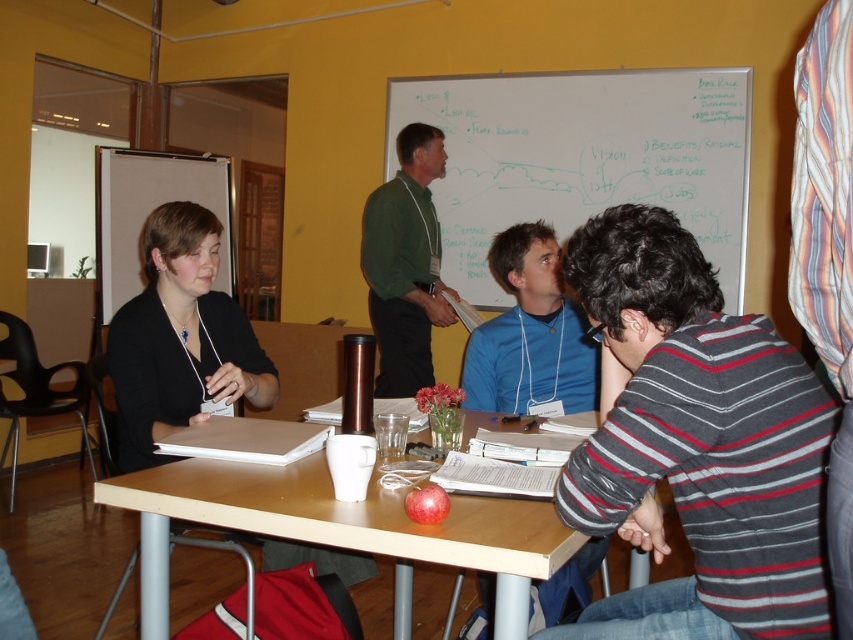
You are standing at the entrance of the room and want to place a new poster on the wall near the black matte jacket at upper left. Based on its position, where should you place the poster relative to the whiteboard?

The black matte jacket at upper left is located at point (180, 339), which is closer to the left side of the wall. Therefore, you should place the poster on the left side of the whiteboard to align with the jacket.

You are an observer looking at the scene. You see the black matte jacket at upper left and the red matte apple at center. Which object is positioned more to the left side of the scene?

The black matte jacket at upper left is positioned more to the left side of the scene than the red matte apple at center.

You are standing in the room and want to find the striped cotton shirt at center. According to the coordinates given, where should you look in the room?

The striped cotton shirt at center is located at the coordinates point (695, 444) in the room.